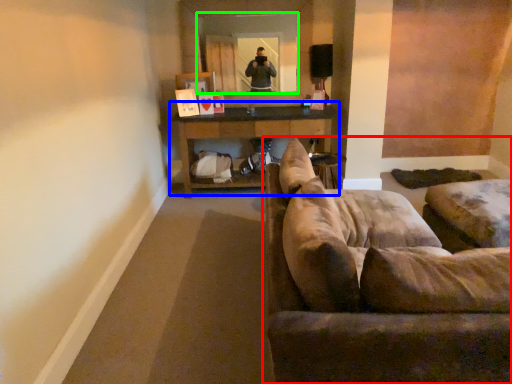
Question: Which object is positioned closest to studio couch (highlighted by a red box)? Select from table (highlighted by a blue box) and mirror (highlighted by a green box).

Choices:
 (A) table
 (B) mirror

Answer: (A)